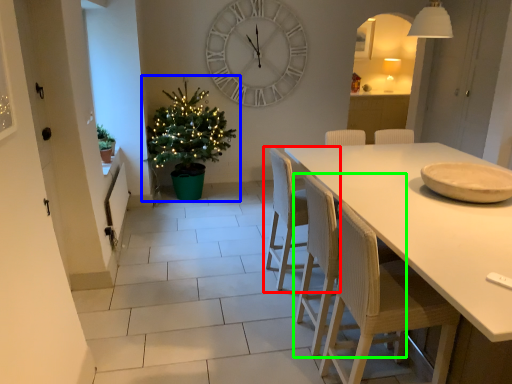
Question: Which is nearer to the chair (highlighted by a red box)? christmas tree (highlighted by a blue box) or chair (highlighted by a green box).

Choices:
 (A) christmas tree
 (B) chair

Answer: (B)